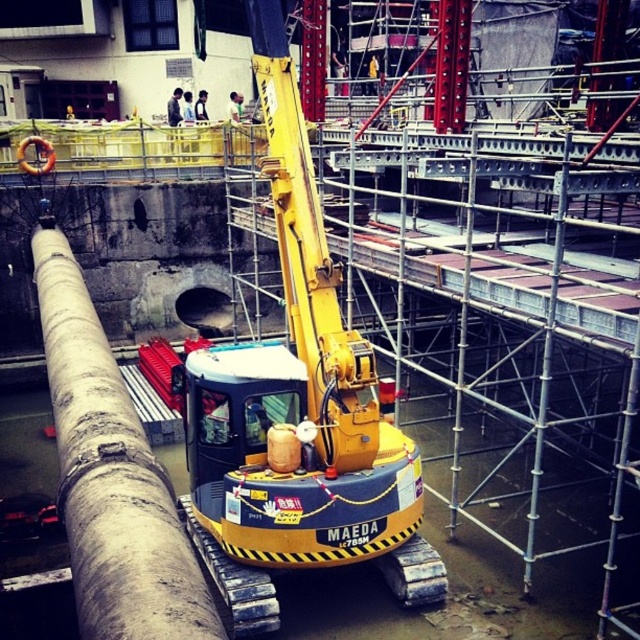
You are a construction worker standing at the origin point of the image coordinate system. You need to locate the yellow rubbermaid excavator at center. What are the coordinates where you should look to find it?

The yellow rubbermaid excavator at center is located at coordinates point (298, 406).

You are a construction worker who needs to move the gray concrete pipe at center to a different location. Given that the yellow rubbermaid excavator at center is available, can you use it to lift the pipe? Explain your reasoning based on their positions.

The yellow rubbermaid excavator at center is located below the gray concrete pipe at center, so the excavator can position itself underneath the pipe to lift it safely.

You are a construction worker planning to move the yellow rubbermaid excavator at center and the gray concrete pipe at center to a storage area. Given the space available, which object would require more space to store?

The gray concrete pipe at center requires more space to store because the yellow rubbermaid excavator at center occupies less space than it.